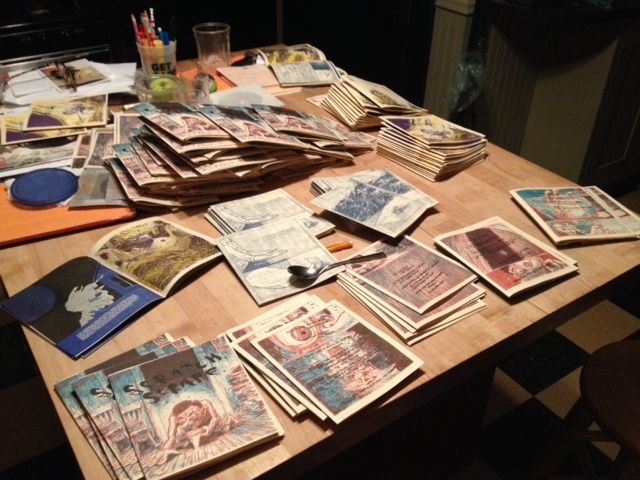
Find the location of a particular element. The width and height of the screenshot is (640, 480). table is located at coordinates (476, 320), (470, 201), (188, 297).